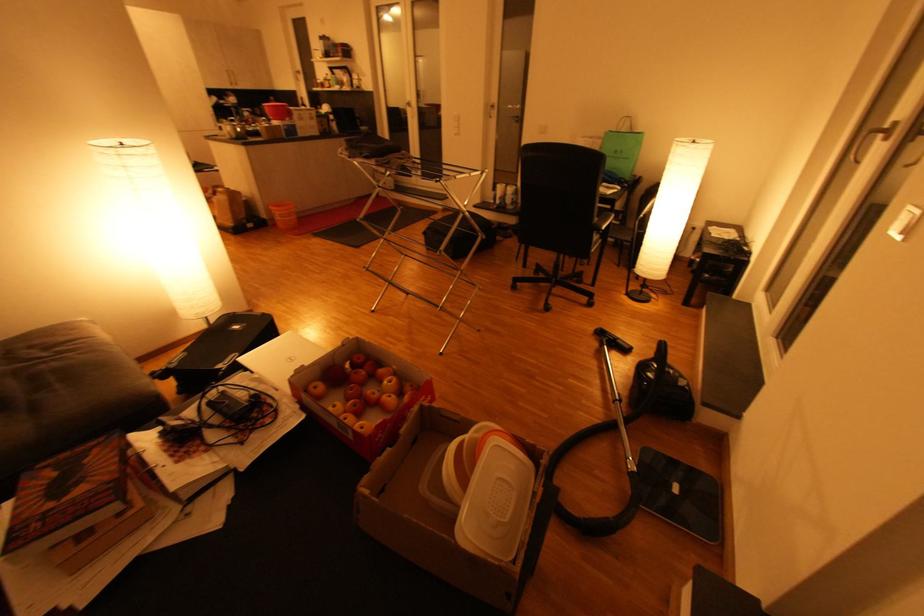
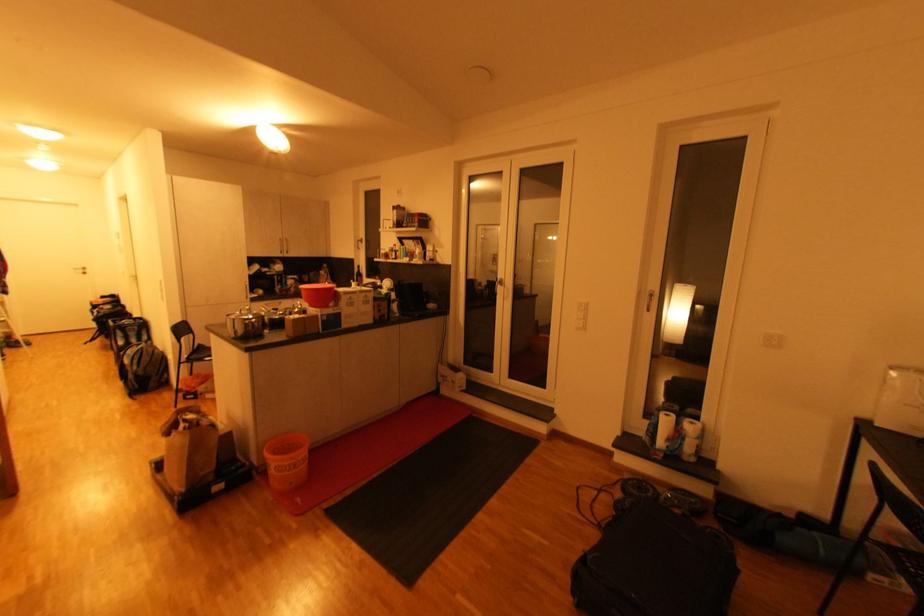
Find the pixel in the second image that matches (237,86) in the first image.

(286, 254)